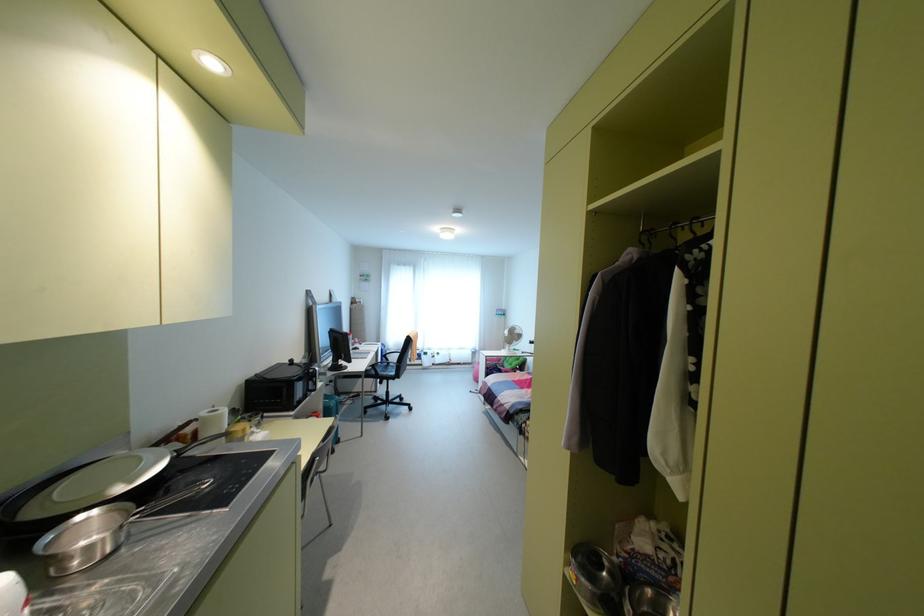
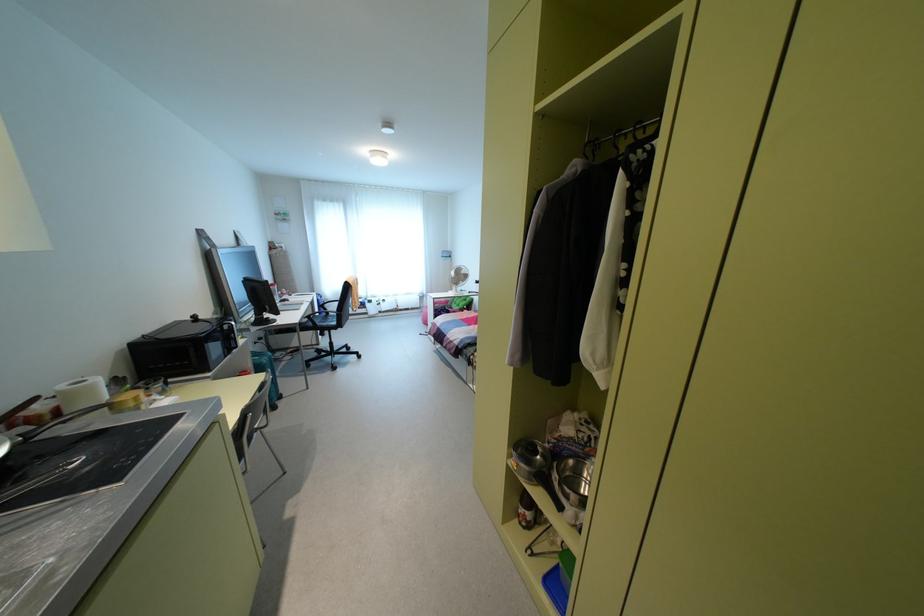
The point at (203, 413) is marked in the first image. Where is the corresponding point in the second image?

(62, 387)